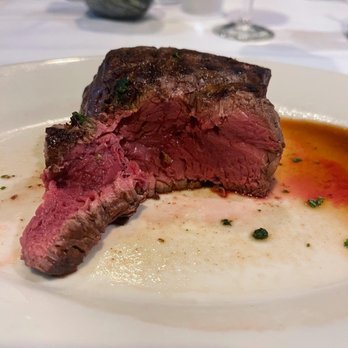
The width and height of the screenshot is (348, 348). I want to click on item on table, so click(x=132, y=15).